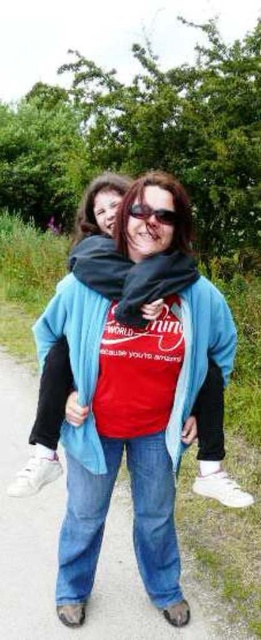
Does matte blue sweatshirt at center appear under shiny black sunglasses at center?

Yes, matte blue sweatshirt at center is below shiny black sunglasses at center.

Is matte blue sweatshirt at center to the left of shiny black sunglasses at center from the viewer's perspective?

Yes, matte blue sweatshirt at center is to the left of shiny black sunglasses at center.

Image resolution: width=261 pixels, height=640 pixels. In order to click on matte blue sweatshirt at center in this screenshot , I will do `click(133, 326)`.

Is denim jeans at lower center wider than matte blue sweatshirt at center?

Yes, denim jeans at lower center is wider than matte blue sweatshirt at center.

Describe the element at coordinates (109, 548) in the screenshot. I see `denim jeans at lower center` at that location.

This screenshot has height=640, width=261. Identify the location of denim jeans at lower center. (109, 548).

Is point (30, 426) more distant than point (133, 211)?

Yes, point (30, 426) is behind point (133, 211).

Is denim jeans at lower center bigger than shiny black sunglasses at center?

Indeed, denim jeans at lower center has a larger size compared to shiny black sunglasses at center.

Locate an element on the screen. denim jeans at lower center is located at coordinates (109, 548).

Where is `denim jeans at lower center`? The image size is (261, 640). denim jeans at lower center is located at coordinates (109, 548).